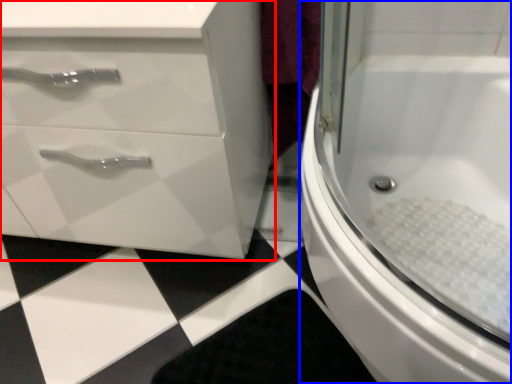
Question: Among these objects, which one is farthest to the camera, bathroom cabinet (highlighted by a red box) or bath (highlighted by a blue box)?

Choices:
 (A) bathroom cabinet
 (B) bath

Answer: (A)